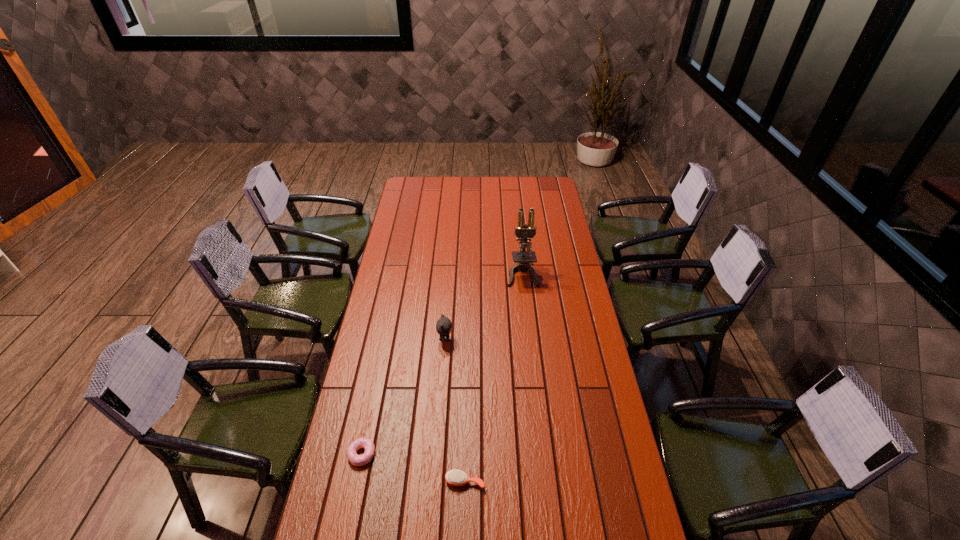
This screenshot has height=540, width=960. What are the coordinates of `vacant space that is in between the second farthest object and the leftmost object` in the screenshot? It's located at (403, 396).

Where is `vacant area between the second object from left to right and the microscope`? vacant area between the second object from left to right and the microscope is located at coordinates (484, 307).

You are a GUI agent. You are given a task and a screenshot of the screen. Output one action in this format:
    pyautogui.click(x=<x>, y=<y>)
    Task: Click on the free space that is in between the third object from left to right and the kitten
    Image resolution: width=960 pixels, height=540 pixels.
    Given the screenshot: What is the action you would take?
    pyautogui.click(x=455, y=410)

At what (x,y) coordinates should I click in order to perform the action: click on free point between the second nearest object and the second object from right to left. Please return your answer as a coordinate pair (x, y). The width and height of the screenshot is (960, 540). Looking at the image, I should click on click(x=414, y=468).

Where is `free area in between the third object from left to right and the rightmost object`? The height and width of the screenshot is (540, 960). free area in between the third object from left to right and the rightmost object is located at coordinates (493, 377).

The image size is (960, 540). I want to click on free space between the rightmost object and the nearest object, so click(x=493, y=377).

Point out which object is positioned as the second nearest to the second nearest object. Please provide its 2D coordinates. Your answer should be formatted as a tuple, i.e. [(x, y)], where the tuple contains the x and y coordinates of a point satisfying the conditions above.

[(443, 326)]

Identify which object is the nearest to the third shortest object. Please provide its 2D coordinates. Your answer should be formatted as a tuple, i.e. [(x, y)], where the tuple contains the x and y coordinates of a point satisfying the conditions above.

[(523, 258)]

This screenshot has width=960, height=540. I want to click on free spot that satisfies the following two spatial constraints: 1. at the eyepieces of the farthest object; 2. on the front-facing side of the third shortest object, so click(529, 339).